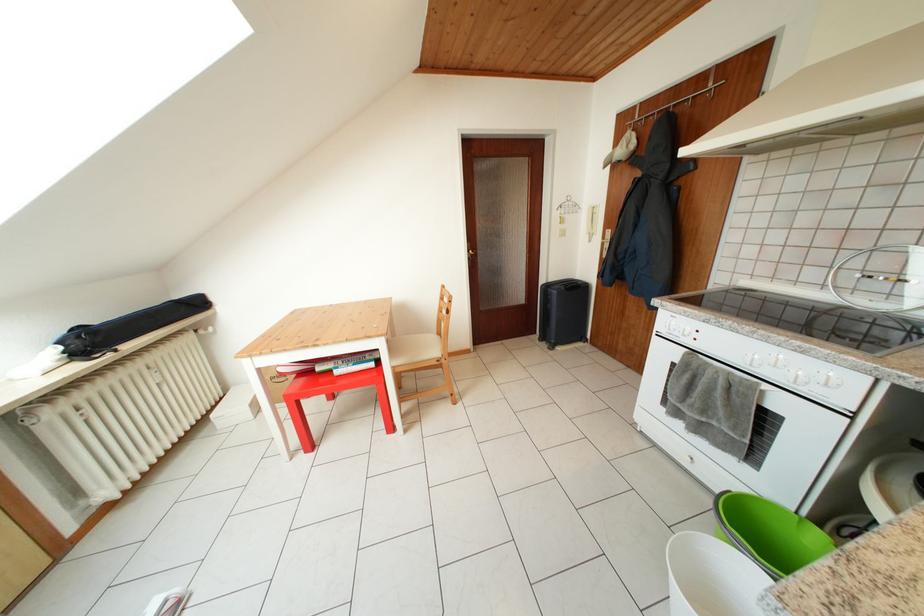
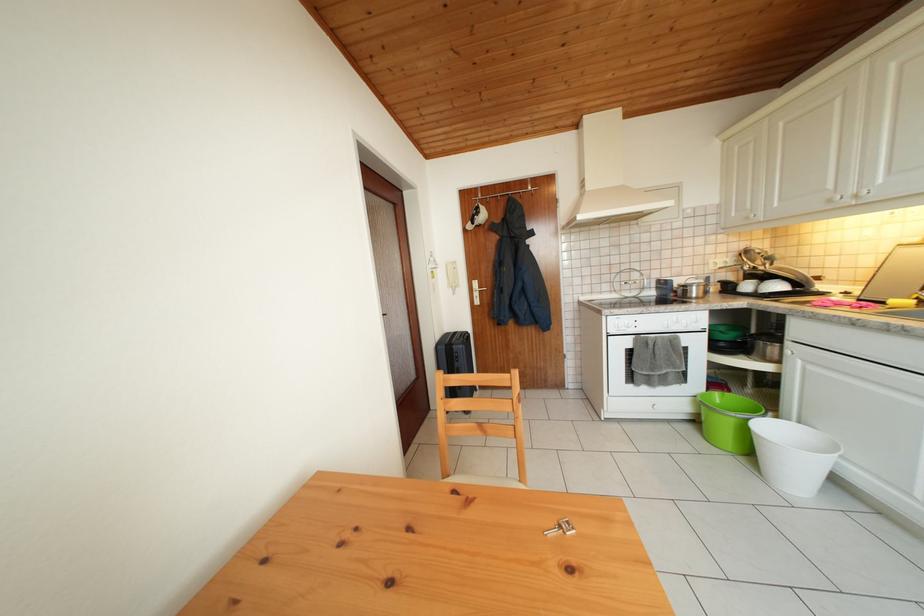
The point at (828, 540) is marked in the first image. Where is the corresponding point in the second image?

(724, 399)